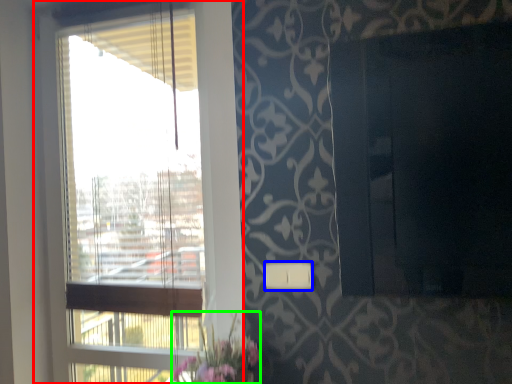
Question: Which object is the farthest from window (highlighted by a red box)? Choose among these: light switch (highlighted by a blue box) or floral arrangement (highlighted by a green box).

Choices:
 (A) light switch
 (B) floral arrangement

Answer: (A)